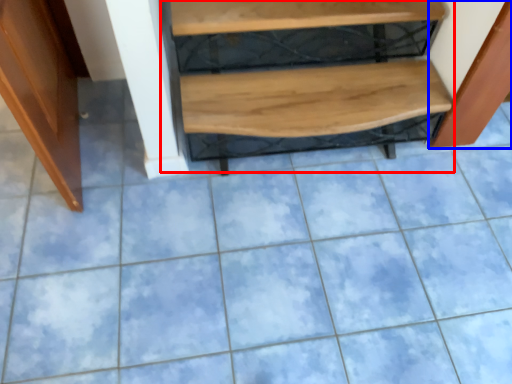
Question: Among these objects, which one is farthest to the camera, stairwell (highlighted by a red box) or cabinetry (highlighted by a blue box)?

Choices:
 (A) stairwell
 (B) cabinetry

Answer: (A)